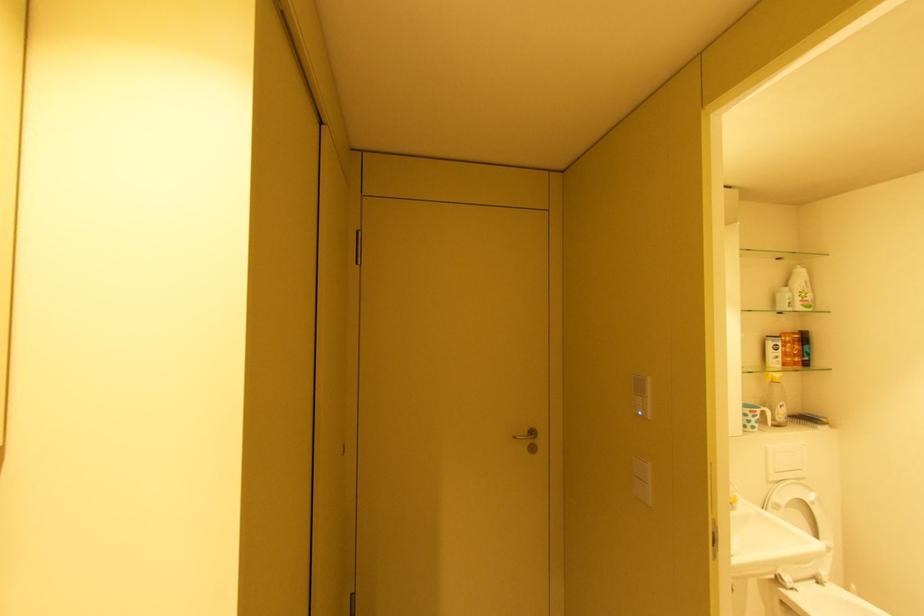
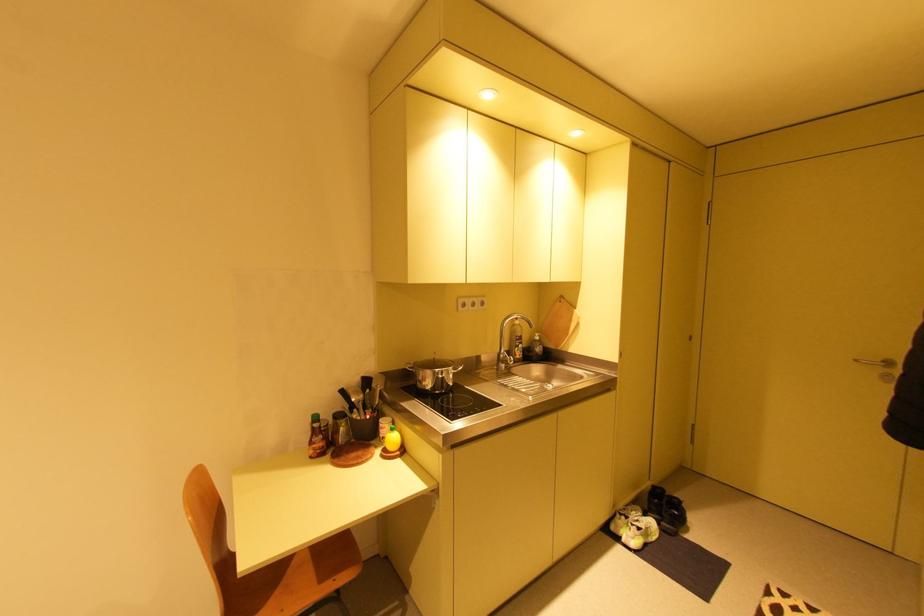
Where in the second image is the point corresponding to [520,438] from the first image?

(861, 361)